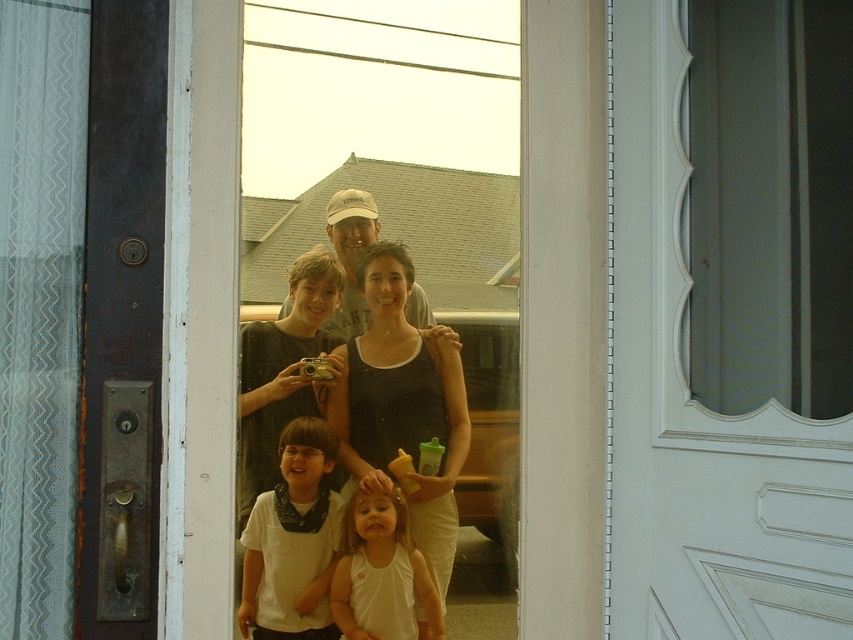
The width and height of the screenshot is (853, 640). In order to click on white matte shirt at center in this screenshot , I will do `click(292, 540)`.

Who is more forward, (329, 497) or (351, 294)?

Point (329, 497)

Locate an element on the screen. This screenshot has width=853, height=640. white matte shirt at center is located at coordinates (292, 540).

In order to click on white matte shirt at center in this screenshot , I will do `click(292, 540)`.

Can you confirm if black matte tank top at center is wider than matte white tank top at center?

No, black matte tank top at center is not wider than matte white tank top at center.

The height and width of the screenshot is (640, 853). Identify the location of black matte tank top at center. (403, 404).

Identify the location of black matte tank top at center. (403, 404).

Find the location of a particular element. The height and width of the screenshot is (640, 853). black matte tank top at center is located at coordinates (403, 404).

Between transparent glass door at center and white matte tank top at center, which one is positioned lower?

white matte tank top at center

Who is positioned more to the left, transparent glass door at center or white matte tank top at center?

From the viewer's perspective, transparent glass door at center appears more on the left side.

Is point (469, 20) positioned after point (399, 611)?

Yes, it is behind point (399, 611).

Where is `transparent glass door at center`? The image size is (853, 640). transparent glass door at center is located at coordinates (357, 209).